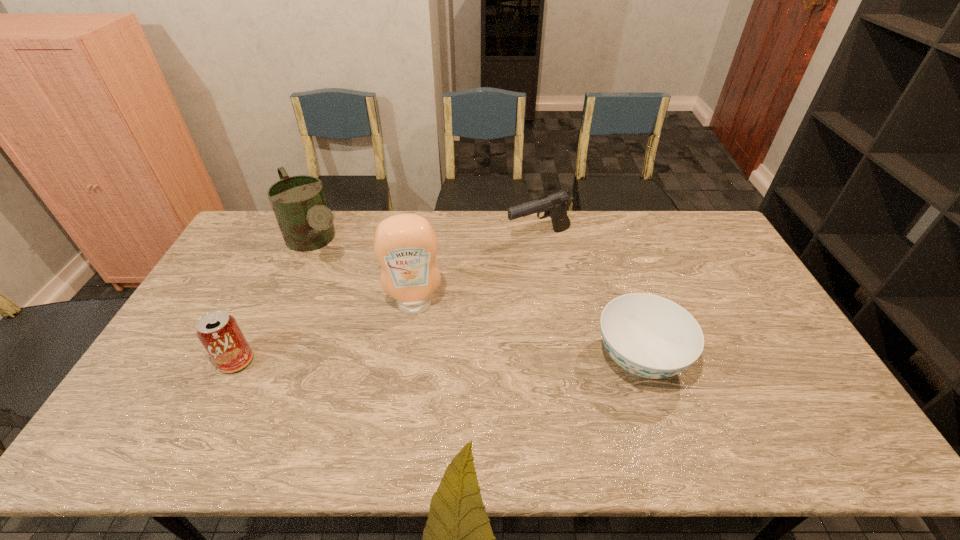
This screenshot has height=540, width=960. Find the location of `object located in the left edge section of the desktop`. object located in the left edge section of the desktop is located at coordinates (299, 203).

Where is `object that is at the far left corner`? This screenshot has height=540, width=960. object that is at the far left corner is located at coordinates (299, 203).

The height and width of the screenshot is (540, 960). In order to click on vacant area at the far edge of the desktop in this screenshot , I will do `click(471, 232)`.

In the image, there is a desktop. At what (x,y) coordinates should I click in order to perform the action: click on free space at the near edge. Please return your answer as a coordinate pair (x, y). Looking at the image, I should click on (373, 402).

Where is `vacant area at the left edge of the desktop`? This screenshot has height=540, width=960. vacant area at the left edge of the desktop is located at coordinates (223, 307).

I want to click on free space at the right edge, so click(x=788, y=339).

This screenshot has height=540, width=960. I want to click on free space at the near left corner of the desktop, so click(165, 396).

I want to click on free point between the chinaware and the soda can, so click(x=438, y=360).

Locate an element on the screen. The image size is (960, 540). free space that is in between the watering can and the soda can is located at coordinates pyautogui.click(x=276, y=302).

You are a GUI agent. You are given a task and a screenshot of the screen. Output one action in this format:
    pyautogui.click(x=<x>, y=<y>)
    Task: Click on the free space between the shortest object and the third nearest object
    
    Given the screenshot: What is the action you would take?
    pyautogui.click(x=527, y=332)